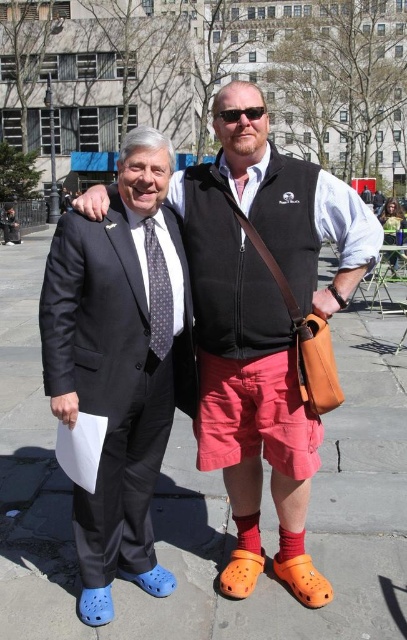
Does dark gray dotted tie at center appear on the right side of sunglasses at center?

In fact, dark gray dotted tie at center is to the left of sunglasses at center.

Can you confirm if dark gray dotted tie at center is positioned above sunglasses at center?

No, dark gray dotted tie at center is not above sunglasses at center.

You are a GUI agent. You are given a task and a screenshot of the screen. Output one action in this format:
    pyautogui.click(x=<x>, y=<y>)
    Task: Click on the dark gray dotted tie at center
    Image resolution: width=407 pixels, height=640 pixels.
    Given the screenshot: What is the action you would take?
    tap(157, 292)

Is point (363, 348) less distant than point (223, 120)?

No.

Can you confirm if gray concrete pavement at center is bigger than sunglasses at center?

Yes.

You are a GUI agent. You are given a task and a screenshot of the screen. Output one action in this format:
    pyautogui.click(x=<x>, y=<y>)
    Task: Click on the gray concrete pavement at center
    This screenshot has width=407, height=640.
    Given the screenshot: What is the action you would take?
    pos(205,502)

Can you confirm if gray concrete pavement at center is bigger than matte black suit at left?

Yes.

Which is in front, point (343, 465) or point (80, 312)?

Point (80, 312) is in front.

Where is `gray concrete pavement at center`? The width and height of the screenshot is (407, 640). gray concrete pavement at center is located at coordinates (205, 502).